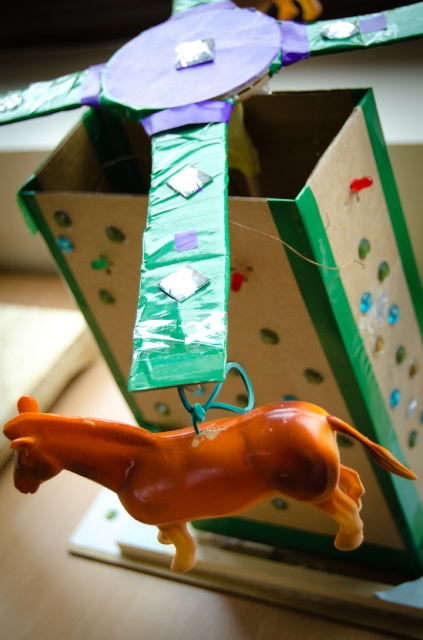
You are a child trying to attach a ribbon to the green cardboard box at center and the orange glossy horse at lower center. If the ribbon is 12 inches long, will it be long enough to reach both objects?

The green cardboard box at center is 12.54 inches away from the orange glossy horse at lower center. Since the ribbon is only 12 inches long, it is slightly shorter than the distance between the two objects. Therefore, the ribbon will not be long enough to reach both the green cardboard box at center and the orange glossy horse at lower center.

You are a child trying to place a sticker on the green cardboard box at center and the orange glossy horse at lower center. Which object requires a larger sticker to fully cover its width?

The green cardboard box at center might require a larger sticker because it is wider than the orange glossy horse at lower center.